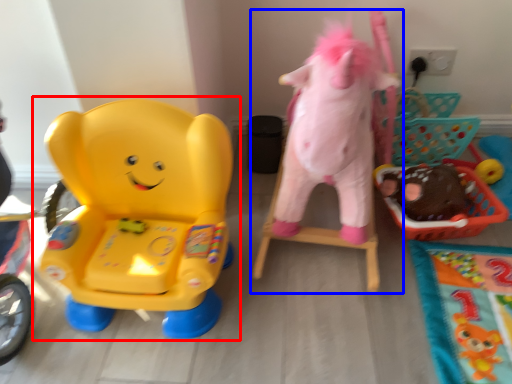
Question: Which point is further to the camera, toy (highlighted by a red box) or toy (highlighted by a blue box)?

Choices:
 (A) toy
 (B) toy

Answer: (A)